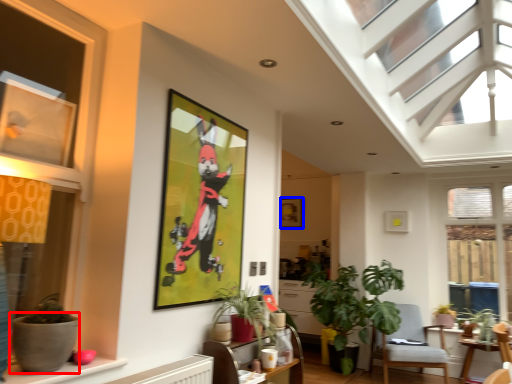
Question: Among these objects, which one is nearest to the camera, flowerpot (highlighted by a red box) or picture frame (highlighted by a blue box)?

Choices:
 (A) flowerpot
 (B) picture frame

Answer: (A)